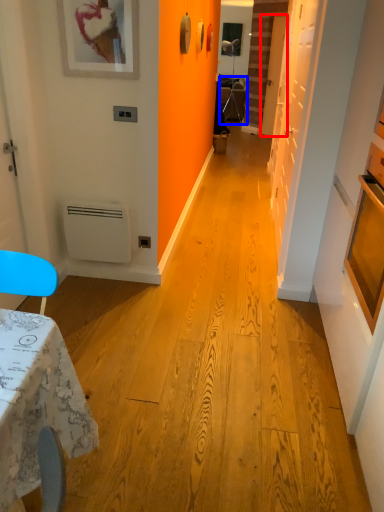
Question: Which point is further to the camera, door (highlighted by a red box) or armchair (highlighted by a blue box)?

Choices:
 (A) door
 (B) armchair

Answer: (B)